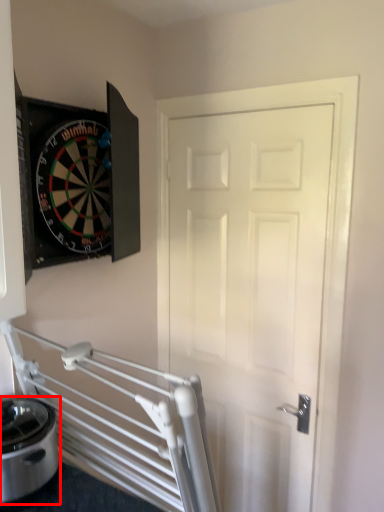
Question: From the image's perspective, what is the correct spatial positioning of appliance (annotated by the red box) in reference to door?

Choices:
 (A) above
 (B) below

Answer: (B)